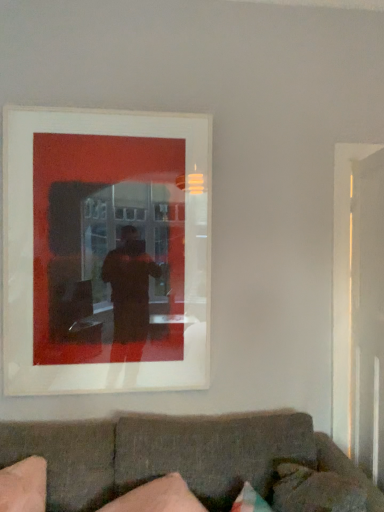
Question: Is velvet pink pillow at lower right, which appears as the first pillow when viewed from the right, inside the boundaries of dark gray fabric couch at lower center, or outside?

Choices:
 (A) inside
 (B) outside

Answer: (A)

Question: Relative to dark gray fabric couch at lower center, is velvet pink pillow at lower right, which appears as the first pillow when viewed from the right, in front or behind?

Choices:
 (A) front
 (B) behind

Answer: (B)

Question: Considering the real-world distances, which object is farthest from the velvet pink pillow at lower right, placed as the second pillow when sorted from left to right?

Choices:
 (A) dark gray fabric couch at lower center
 (B) matte white picture frame at upper center
 (C) pink fabric pillow at lower left, which ranks as the first pillow in left-to-right order
 (D) transparent glass door at right

Answer: (B)

Question: Estimate the real-world distances between objects in this image. Which object is farther from the pink fabric pillow at lower left, acting as the second pillow starting from the right?

Choices:
 (A) dark gray fabric couch at lower center
 (B) transparent glass door at right
 (C) velvet pink pillow at lower right, placed as the second pillow when sorted from left to right
 (D) matte white picture frame at upper center

Answer: (B)